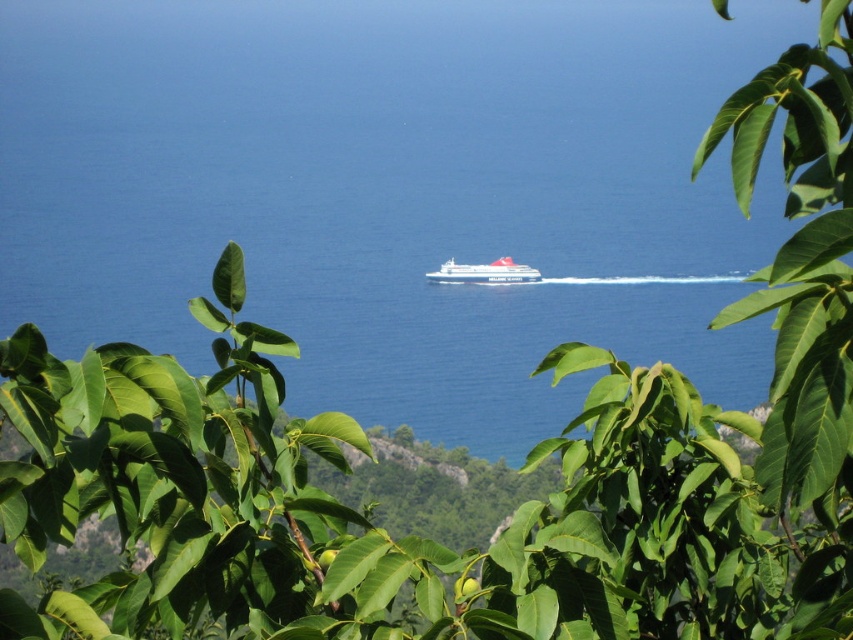
You are standing at the vantage point on land looking at the seascape. There are two points marked in the image. Which point is closer to you, point (x=614, y=51) or point (x=517, y=276)?

Point (x=614, y=51) is further to the camera than point (x=517, y=276), so point (x=517, y=276) is closer to you.